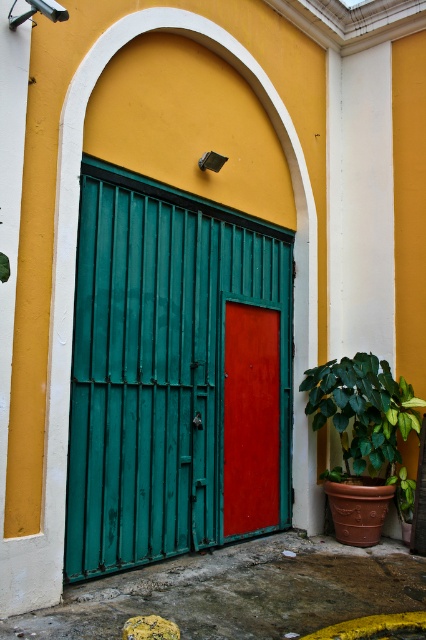
Which is more to the left, green metal/glass door at center or smooth glossy red door at center?

From the viewer's perspective, green metal/glass door at center appears more on the left side.

Which is behind, point (120, 460) or point (270, 353)?

The point (270, 353) is behind.

This screenshot has width=426, height=640. Find the location of `green metal/glass door at center`. green metal/glass door at center is located at coordinates (175, 374).

Is green metal/glass door at center taller than green glossy leafy plant at lower right?

Yes, green metal/glass door at center is taller than green glossy leafy plant at lower right.

Is the position of green metal/glass door at center more distant than that of green glossy leafy plant at lower right?

That is False.

Identify the location of green metal/glass door at center. point(175,374).

I want to click on green metal/glass door at center, so click(x=175, y=374).

Is smooth glossy red door at center shorter than green glossy leafy plant at lower right?

Incorrect, smooth glossy red door at center's height does not fall short of green glossy leafy plant at lower right's.

Is point (230, 371) farther from viewer compared to point (354, 460)?

No.

This screenshot has width=426, height=640. Identify the location of smooth glossy red door at center. (250, 419).